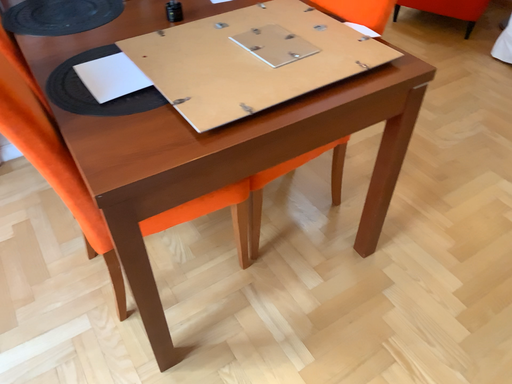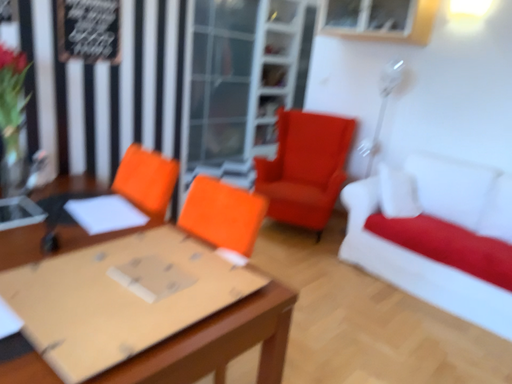
Question: How did the camera likely rotate when shooting the video?

Choices:
 (A) rotated left
 (B) rotated right

Answer: (B)